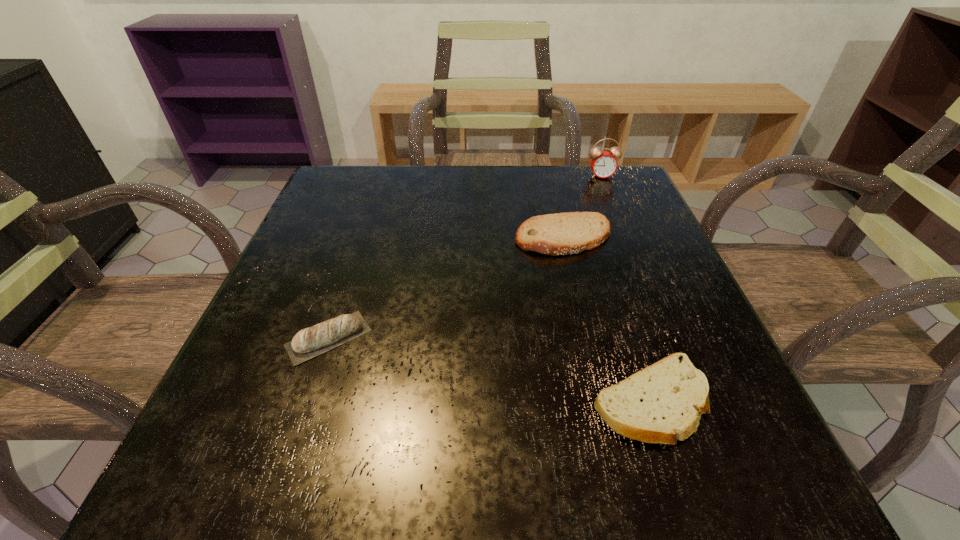
In order to click on object that is at the near edge in this screenshot , I will do `click(659, 404)`.

Where is `object at the left edge`? Image resolution: width=960 pixels, height=540 pixels. object at the left edge is located at coordinates (310, 342).

Identify the location of alarm clock situated at the right edge. (603, 164).

Where is `object located at the far right corner`? The image size is (960, 540). object located at the far right corner is located at coordinates (603, 164).

Where is `object present at the near right corner`? Image resolution: width=960 pixels, height=540 pixels. object present at the near right corner is located at coordinates (659, 404).

Where is `vacant space at the far edge of the desktop`? vacant space at the far edge of the desktop is located at coordinates (490, 188).

Where is `free spot at the near edge of the desktop`? free spot at the near edge of the desktop is located at coordinates (326, 455).

Where is `vacant space at the left edge of the desktop`? Image resolution: width=960 pixels, height=540 pixels. vacant space at the left edge of the desktop is located at coordinates (340, 298).

This screenshot has height=540, width=960. Identify the location of vacant space at the right edge of the desktop. (639, 321).

At what (x,y) coordinates should I click in order to perform the action: click on free space at the far left corner of the desktop. Please return your answer as a coordinate pair (x, y). Image resolution: width=960 pixels, height=540 pixels. Looking at the image, I should click on (345, 201).